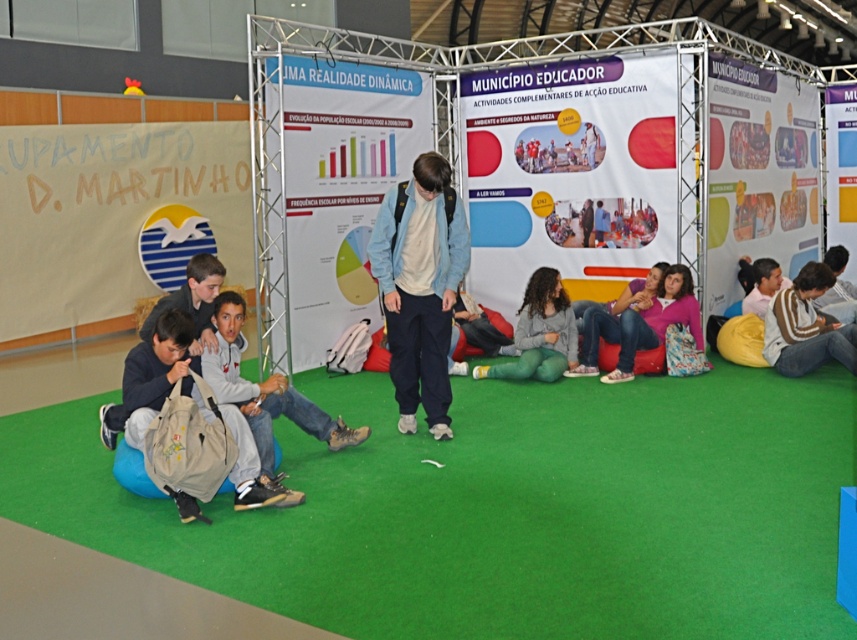
The width and height of the screenshot is (857, 640). Describe the element at coordinates (264, 390) in the screenshot. I see `khaki fabric backpack at center` at that location.

Is khaki fabric backpack at center above gray fleece sweater at center?

No.

Is point (219, 352) behind point (550, 269)?

No, (219, 352) is in front of (550, 269).

I want to click on khaki fabric backpack at center, so click(x=264, y=390).

Does point (778, 308) come behind point (532, 273)?

No.

This screenshot has width=857, height=640. What do you see at coordinates (805, 326) in the screenshot?
I see `brown striped sweater at right` at bounding box center [805, 326].

Image resolution: width=857 pixels, height=640 pixels. In order to click on brown striped sweater at right in this screenshot , I will do `click(805, 326)`.

Between khaki canvas backpack at lower left and gray fleece sweater at center, which one appears on the right side from the viewer's perspective?

Positioned to the right is gray fleece sweater at center.

Does point (262, 484) come behind point (535, 349)?

No, (262, 484) is closer to viewer.

Locate an element on the screen. khaki canvas backpack at lower left is located at coordinates (183, 396).